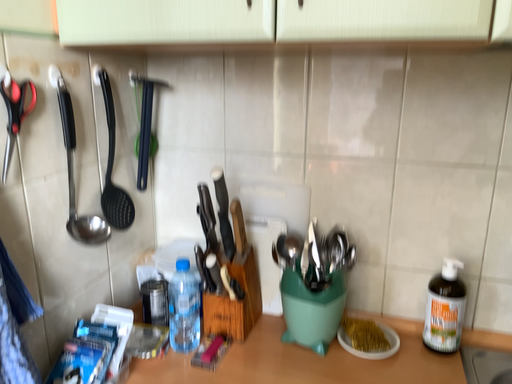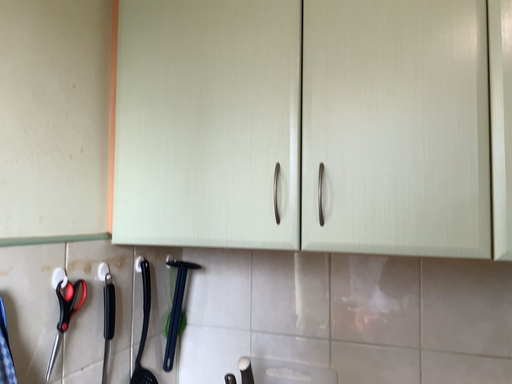
Question: Which way did the camera rotate in the video?

Choices:
 (A) rotated downward
 (B) rotated upward

Answer: (B)